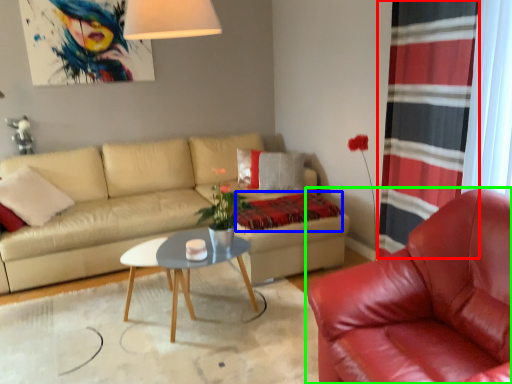
Question: Which object is the farthest from curtain (highlighted by a red box)? Choose among these: blanket (highlighted by a blue box) or chair (highlighted by a green box).

Choices:
 (A) blanket
 (B) chair

Answer: (A)